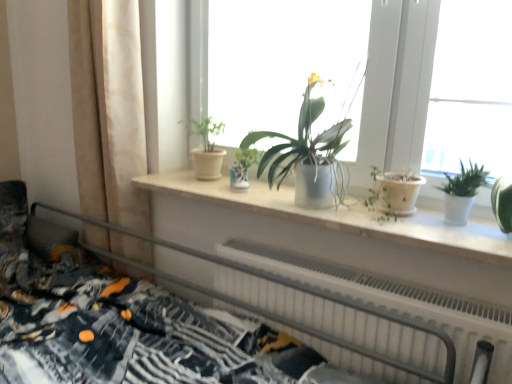
Locate an element on the screen. This screenshot has width=512, height=384. vacant point to the left of white glossy pot at right, which is the 1th houseplant in right-to-left order is located at coordinates (394, 220).